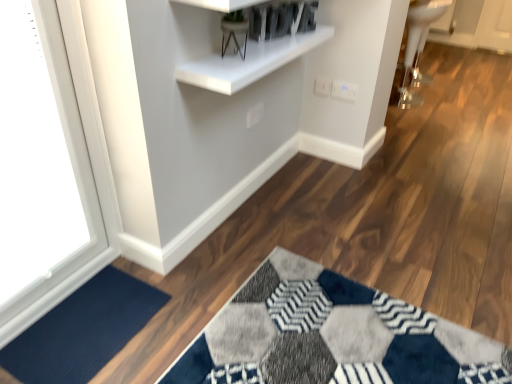
Question: Is white glossy shelf at upper center facing towards white plastic electric outlet at upper center, the first electric outlet from the right?

Choices:
 (A) yes
 (B) no

Answer: (B)

Question: Is white glossy shelf at upper center bigger than white plastic electric outlet at upper center, the 2th electric outlet when ordered from left to right?

Choices:
 (A) no
 (B) yes

Answer: (B)

Question: Considering the relative positions of white glossy shelf at upper center and white plastic electric outlet at upper center, the 2th electric outlet when ordered from left to right, in the image provided, is white glossy shelf at upper center to the right of white plastic electric outlet at upper center, the 2th electric outlet when ordered from left to right, from the viewer's perspective?

Choices:
 (A) yes
 (B) no

Answer: (B)

Question: Is white glossy shelf at upper center located outside white plastic electric outlet at upper center, the 2th electric outlet when ordered from left to right?

Choices:
 (A) yes
 (B) no

Answer: (A)

Question: From the image's perspective, is white glossy shelf at upper center above white plastic electric outlet at upper center, the 2th electric outlet when ordered from left to right?

Choices:
 (A) yes
 (B) no

Answer: (A)

Question: From a real-world perspective, does white glossy shelf at upper center stand above white plastic electric outlet at upper center, the 2th electric outlet when ordered from left to right?

Choices:
 (A) yes
 (B) no

Answer: (A)

Question: Is white glossy sink at upper right aimed at white plastic electric outlet at upper right, the second electric outlet in the right-to-left sequence?

Choices:
 (A) yes
 (B) no

Answer: (B)

Question: Is white glossy sink at upper right to the left of white plastic electric outlet at upper right, which is the 1th electric outlet in left-to-right order, from the viewer's perspective?

Choices:
 (A) yes
 (B) no

Answer: (B)

Question: Considering the relative sizes of white glossy sink at upper right and white plastic electric outlet at upper right, which is the 1th electric outlet in left-to-right order, in the image provided, is white glossy sink at upper right thinner than white plastic electric outlet at upper right, which is the 1th electric outlet in left-to-right order,?

Choices:
 (A) no
 (B) yes

Answer: (A)

Question: From the image's perspective, is white glossy sink at upper right over white plastic electric outlet at upper right, which is the 1th electric outlet in left-to-right order?

Choices:
 (A) no
 (B) yes

Answer: (B)

Question: Is white glossy sink at upper right positioned in front of white plastic electric outlet at upper right, which is the 1th electric outlet in left-to-right order?

Choices:
 (A) no
 (B) yes

Answer: (A)

Question: Is white glossy sink at upper right positioned far away from white plastic electric outlet at upper right, which is the 1th electric outlet in left-to-right order?

Choices:
 (A) yes
 (B) no

Answer: (A)

Question: Is white glossy sink at upper right located within white plastic electric outlet at upper center, the first electric outlet from the right?

Choices:
 (A) no
 (B) yes

Answer: (A)